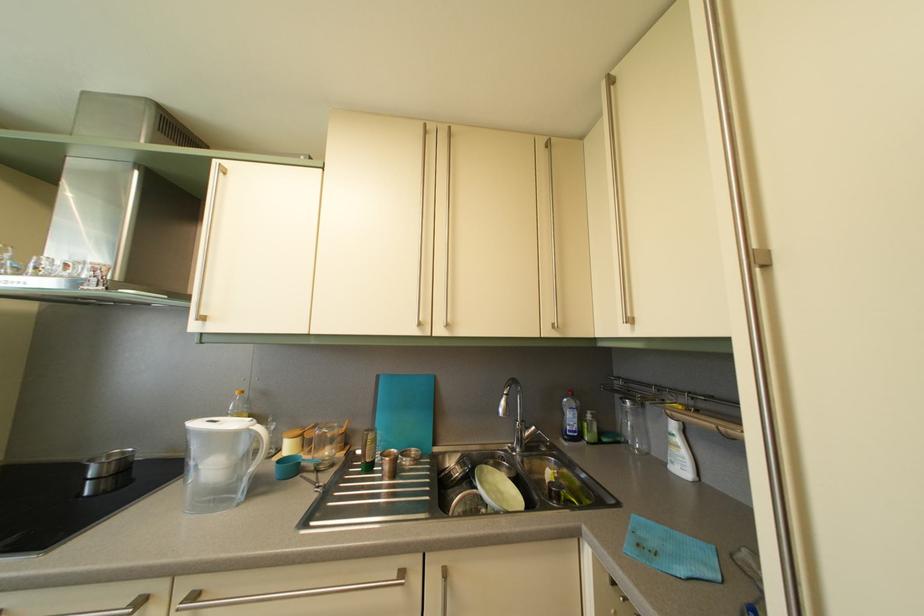
Find where to push the pump dispenser. Please return your answer as a coordinate pair (x, y).

(678, 450)